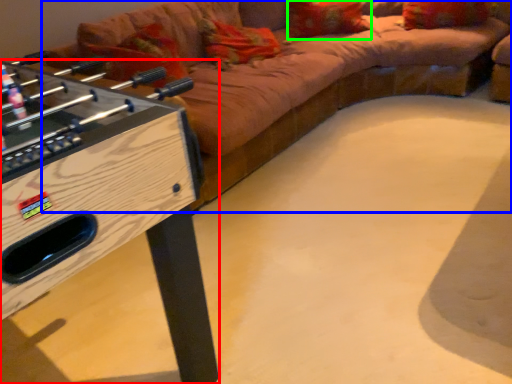
Question: Which object is the farthest from furniture (highlighted by a red box)? Choose among these: studio couch (highlighted by a blue box) or pillow (highlighted by a green box).

Choices:
 (A) studio couch
 (B) pillow

Answer: (B)